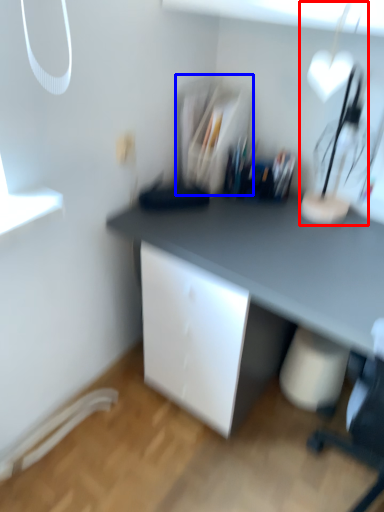
Question: Which object is further to the camera taking this photo, table lamp (highlighted by a red box) or shelf (highlighted by a blue box)?

Choices:
 (A) table lamp
 (B) shelf

Answer: (B)